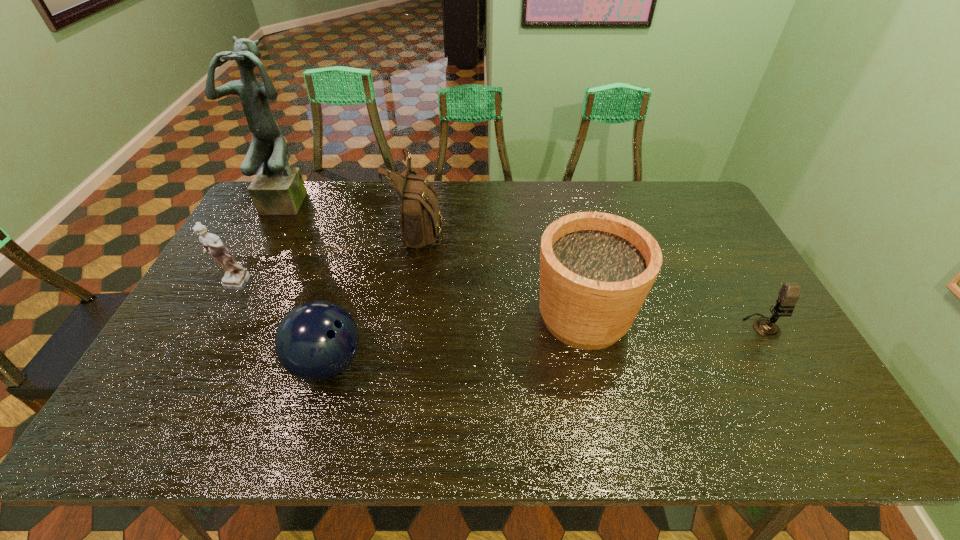
This screenshot has height=540, width=960. Find the location of `empty space between the flowerpot and the shortest object`. empty space between the flowerpot and the shortest object is located at coordinates (673, 321).

Point out which object is positioned as the nearest to the figurine. Please provide its 2D coordinates. Your answer should be formatted as a tuple, i.e. [(x, y)], where the tuple contains the x and y coordinates of a point satisfying the conditions above.

[(315, 341)]

What are the coordinates of `object that can be found as the second closest to the figurine` in the screenshot? It's located at (277, 189).

The height and width of the screenshot is (540, 960). Identify the location of free region that satisfies the following two spatial constraints: 1. on the face of the sculpture; 2. on the left side of the second object from right to left. (229, 317).

Find the location of `free spot that satisfies the following two spatial constraints: 1. on the front-facing side of the fifth object from left to right; 2. on the right side of the figurine`. free spot that satisfies the following two spatial constraints: 1. on the front-facing side of the fifth object from left to right; 2. on the right side of the figurine is located at coordinates (215, 317).

At what (x,y) coordinates should I click in order to perform the action: click on free spot that satisfies the following two spatial constraints: 1. on the front-facing side of the shoulder bag; 2. on the left side of the flowerpot. Please return your answer as a coordinate pair (x, y). Looking at the image, I should click on (406, 317).

Locate an element on the screen. This screenshot has height=540, width=960. vacant space that satisfies the following two spatial constraints: 1. on the front-facing side of the fourth object from left to right; 2. on the left side of the flowerpot is located at coordinates (406, 317).

Find the location of a particular element. This screenshot has height=540, width=960. vacant space that satisfies the following two spatial constraints: 1. on the front-facing side of the shoulder bag; 2. on the left side of the flowerpot is located at coordinates coord(406,317).